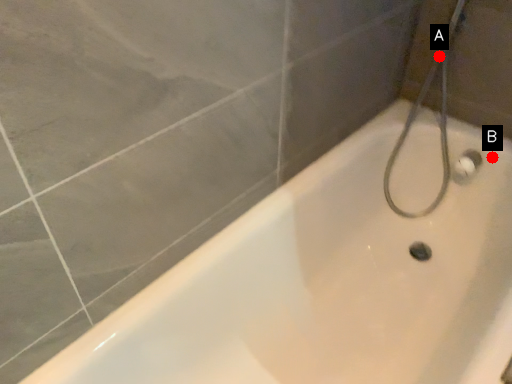
Question: Two points are circled on the image, labeled by A and B beside each circle. Which point is closer to the camera?

Choices:
 (A) A is closer
 (B) B is closer

Answer: (B)